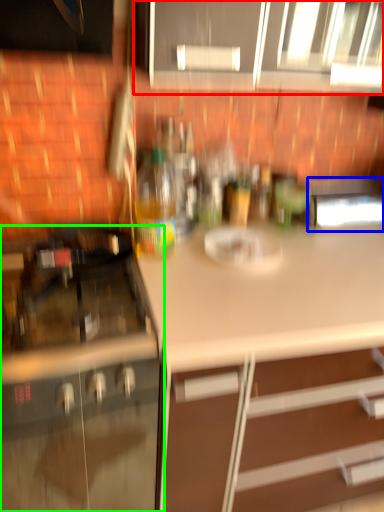
Question: Which object is positioned closest to cabinetry (highlighted by a red box)? Select from appliance (highlighted by a blue box) and cabinetry (highlighted by a green box).

Choices:
 (A) appliance
 (B) cabinetry

Answer: (A)